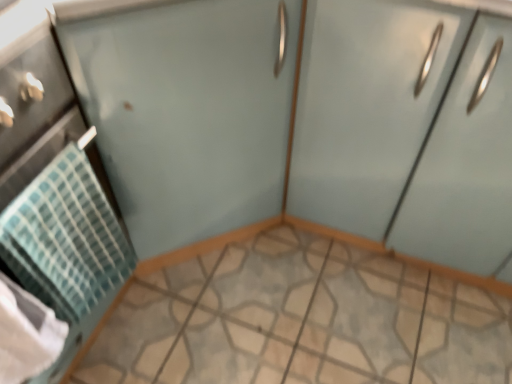
Find the location of a particular element. The width and height of the screenshot is (512, 384). matte teal towel at left is located at coordinates 54,187.

Describe the element at coordinates (65, 237) in the screenshot. Image resolution: width=512 pixels, height=384 pixels. I see `teal woven towel at left` at that location.

What do you see at coordinates (406, 131) in the screenshot?
I see `matte light blue cabinet at right` at bounding box center [406, 131].

Where is `matte teal towel at left`? The width and height of the screenshot is (512, 384). matte teal towel at left is located at coordinates (54, 187).

Can you tell me how much matte light blue cabinet at right and matte teal towel at left differ in facing direction?

89.8 degrees.

Consider the image. Considering the sizes of objects matte light blue cabinet at right and matte teal towel at left in the image provided, who is smaller, matte light blue cabinet at right or matte teal towel at left?

matte teal towel at left.

Between matte light blue cabinet at right and matte teal towel at left, which one has less height?

matte teal towel at left.

Considering the relative sizes of teal woven towel at left and matte teal towel at left in the image provided, is teal woven towel at left thinner than matte teal towel at left?

Yes, teal woven towel at left is thinner than matte teal towel at left.

Can you confirm if teal woven towel at left is positioned to the left of matte teal towel at left?

No.

Considering their positions, is teal woven towel at left located in front of or behind matte teal towel at left?

Visually, teal woven towel at left is located behind matte teal towel at left.

The width and height of the screenshot is (512, 384). Identify the location of appliance directly beneath the matte light blue cabinet at right (from a real-world perspective). (54, 187).

From a real-world perspective, which object rests below the other?

matte teal towel at left, from a real-world perspective.

Can you confirm if matte teal towel at left is wider than matte light blue cabinet at right?

Yes, matte teal towel at left is wider than matte light blue cabinet at right.

Does point (442, 150) come closer to viewer compared to point (6, 241)?

No, it is behind (6, 241).

Is teal woven towel at left located within matte light blue cabinet at right?

No, teal woven towel at left is not surrounded by matte light blue cabinet at right.

Who is smaller, clear glass screen door at upper right or matte light blue cabinet at right?

matte light blue cabinet at right.

Between clear glass screen door at upper right and matte light blue cabinet at right, which one has larger width?

clear glass screen door at upper right.

From a real-world perspective, who is located higher, clear glass screen door at upper right or matte light blue cabinet at right?

clear glass screen door at upper right, from a real-world perspective.

Is point (177, 131) more distant than point (465, 124)?

Yes, point (177, 131) is farther from viewer.

Is matte teal towel at left not inside clear glass screen door at upper right?

matte teal towel at left is positioned outside clear glass screen door at upper right.

Who is shorter, matte teal towel at left or clear glass screen door at upper right?

matte teal towel at left is shorter.

Is matte teal towel at left oriented towards clear glass screen door at upper right?

No, matte teal towel at left does not turn towards clear glass screen door at upper right.

Can you confirm if teal woven towel at left is positioned to the right of matte light blue cabinet at right?

In fact, teal woven towel at left is to the left of matte light blue cabinet at right.

Based on the photo, what's the angular difference between teal woven towel at left and matte light blue cabinet at right's facing directions?

They differ by 91 degrees in their facing directions.

Is teal woven towel at left next to matte light blue cabinet at right and touching it?

They are not placed beside each other.

Looking at this image, measure the distance from teal woven towel at left to matte light blue cabinet at right.

A distance of 62.11 centimeters exists between teal woven towel at left and matte light blue cabinet at right.

You are a GUI agent. You are given a task and a screenshot of the screen. Output one action in this format:
    pyautogui.click(x=<x>, y=<y>)
    Task: Click on the cabinetry above the matte teal towel at left (from the image's perspective)
    This screenshot has height=384, width=512.
    Given the screenshot: What is the action you would take?
    pyautogui.click(x=406, y=131)

Locate an element on the screen. This screenshot has height=384, width=512. blanket to the right of matte teal towel at left is located at coordinates (65, 237).

Looking at the image, which one is located further to teal woven towel at left, matte teal towel at left or clear glass screen door at upper right?

The object further to teal woven towel at left is clear glass screen door at upper right.

From the image, which object appears to be nearer to clear glass screen door at upper right, teal woven towel at left or matte light blue cabinet at right?

Among the two, teal woven towel at left is located nearer to clear glass screen door at upper right.

Based on their spatial positions, is teal woven towel at left or clear glass screen door at upper right further from matte light blue cabinet at right?

teal woven towel at left is further to matte light blue cabinet at right.

Based on their spatial positions, is matte light blue cabinet at right or clear glass screen door at upper right closer to teal woven towel at left?

Among the two, clear glass screen door at upper right is located nearer to teal woven towel at left.

Which object lies nearer to the anchor point matte teal towel at left, clear glass screen door at upper right or teal woven towel at left?

teal woven towel at left.

When comparing their distances from clear glass screen door at upper right, does matte teal towel at left or teal woven towel at left seem further?

Among the two, teal woven towel at left is located further to clear glass screen door at upper right.

Which object lies nearer to the anchor point clear glass screen door at upper right, teal woven towel at left or matte teal towel at left?

matte teal towel at left lies closer to clear glass screen door at upper right than the other object.

Estimate the real-world distances between objects in this image. Which object is further from matte light blue cabinet at right, matte teal towel at left or teal woven towel at left?

The object further to matte light blue cabinet at right is teal woven towel at left.

Image resolution: width=512 pixels, height=384 pixels. I want to click on screen door situated between teal woven towel at left and matte light blue cabinet at right from left to right, so click(x=188, y=113).

Find the location of `blanket between matte teal towel at left and matte light blue cabinet at right`. blanket between matte teal towel at left and matte light blue cabinet at right is located at coordinates [65, 237].

What are the coordinates of `blanket that lies between clear glass screen door at upper right and matte teal towel at left from top to bottom` in the screenshot? It's located at (65, 237).

The width and height of the screenshot is (512, 384). I want to click on screen door between matte teal towel at left and matte light blue cabinet at right from left to right, so click(188, 113).